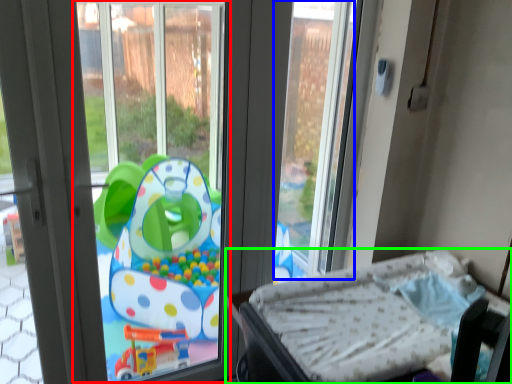
Question: Which object is the closest to the window screen (highlighted by a red box)? Choose among these: window screen (highlighted by a blue box) or furniture (highlighted by a green box).

Choices:
 (A) window screen
 (B) furniture

Answer: (A)